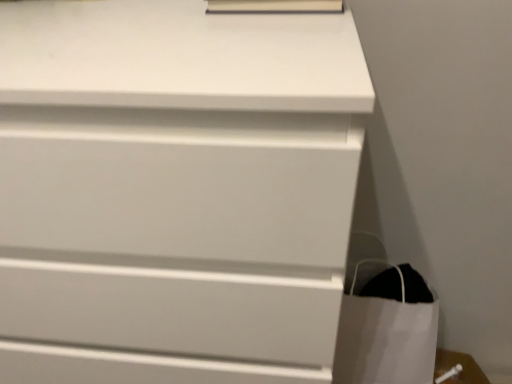
Identify the location of white matte chest of drawers at center. The image size is (512, 384). (175, 191).

What do you see at coordinates (388, 330) in the screenshot?
I see `white paper bag at lower right` at bounding box center [388, 330].

The width and height of the screenshot is (512, 384). What are the coordinates of `white matte chest of drawers at center` in the screenshot? It's located at (175, 191).

Is white matte chest of drawers at center to the right of matte white book at upper center from the viewer's perspective?

In fact, white matte chest of drawers at center is to the left of matte white book at upper center.

Is white matte chest of drawers at center with matte white book at upper center?

They are not placed beside each other.

In the scene shown: Considering the relative sizes of white matte chest of drawers at center and matte white book at upper center in the image provided, is white matte chest of drawers at center bigger than matte white book at upper center?

Yes.

Which of these two, white matte chest of drawers at center or matte white book at upper center, stands shorter?

matte white book at upper center is shorter.

Would you say white paper bag at lower right is to the left or to the right of white matte chest of drawers at center in the picture?

white paper bag at lower right is positioned on white matte chest of drawers at center's right side.

Considering their positions, is white paper bag at lower right located in front of or behind white matte chest of drawers at center?

In the image, white paper bag at lower right appears behind white matte chest of drawers at center.

Which of these two, white paper bag at lower right or white matte chest of drawers at center, is bigger?

With larger size is white matte chest of drawers at center.

Where is `shopping bag that appears below the white matte chest of drawers at center (from a real-world perspective)`? shopping bag that appears below the white matte chest of drawers at center (from a real-world perspective) is located at coordinates (388, 330).

Who is smaller, matte white book at upper center or white paper bag at lower right?

matte white book at upper center is smaller.

Between matte white book at upper center and white paper bag at lower right, which one appears on the left side from the viewer's perspective?

matte white book at upper center is more to the left.

Is point (340, 6) farther from camera compared to point (379, 374)?

That is False.

Which object is closer to the camera taking this photo, white matte chest of drawers at center or white paper bag at lower right?

white matte chest of drawers at center is closer to the camera.

The width and height of the screenshot is (512, 384). Identify the location of chest of drawers in front of the white paper bag at lower right. (175, 191).

Looking at this image, what's the angular difference between white matte chest of drawers at center and white paper bag at lower right's facing directions?

There is a 0.497-degree angle between the facing directions of white matte chest of drawers at center and white paper bag at lower right.

Would you say white paper bag at lower right is part of white matte chest of drawers at center's contents?

No, white paper bag at lower right is not surrounded by white matte chest of drawers at center.

From the image's perspective, which object appears higher, white paper bag at lower right or matte white book at upper center?

matte white book at upper center.

Considering the positions of objects white paper bag at lower right and matte white book at upper center in the image provided, who is in front, white paper bag at lower right or matte white book at upper center?

matte white book at upper center is more forward.

From the picture: Is white paper bag at lower right placed right next to matte white book at upper center?

white paper bag at lower right is not next to matte white book at upper center, and they're not touching.

Is matte white book at upper center facing away from white matte chest of drawers at center?

No, white matte chest of drawers at center is not at the back of matte white book at upper center.

From a real-world perspective, is matte white book at upper center physically located above or below white matte chest of drawers at center?

From a real-world perspective, matte white book at upper center is physically above white matte chest of drawers at center.

Is matte white book at upper center not within white matte chest of drawers at center?

matte white book at upper center is positioned outside white matte chest of drawers at center.

The image size is (512, 384). What are the coordinates of `the chest of drawers below the matte white book at upper center (from the image's perspective)` in the screenshot? It's located at (175, 191).

In order to click on shopping bag behind the white matte chest of drawers at center in this screenshot , I will do tap(388, 330).

From the image, which object appears to be nearer to matte white book at upper center, white matte chest of drawers at center or white paper bag at lower right?

white matte chest of drawers at center.

Estimate the real-world distances between objects in this image. Which object is further from white matte chest of drawers at center, white paper bag at lower right or matte white book at upper center?

Among the two, white paper bag at lower right is located further to white matte chest of drawers at center.

Looking at the image, which one is located further to white matte chest of drawers at center, matte white book at upper center or white paper bag at lower right?

white paper bag at lower right.

Considering their positions, is white paper bag at lower right positioned closer to matte white book at upper center than white matte chest of drawers at center?

white matte chest of drawers at center lies closer to matte white book at upper center than the other object.

Looking at the image, which one is located further to white paper bag at lower right, white matte chest of drawers at center or matte white book at upper center?

Based on the image, matte white book at upper center appears to be further to white paper bag at lower right.

Considering their positions, is matte white book at upper center positioned closer to white paper bag at lower right than white matte chest of drawers at center?

white matte chest of drawers at center is closer to white paper bag at lower right.

You are a GUI agent. You are given a task and a screenshot of the screen. Output one action in this format:
    pyautogui.click(x=<x>, y=<y>)
    Task: Click on the paperback book between white matte chest of drawers at center and white paper bag at lower right from left to right
    
    Given the screenshot: What is the action you would take?
    pyautogui.click(x=274, y=6)